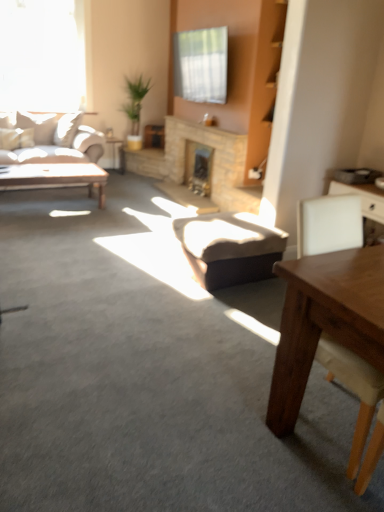
Question: Should I look upward or downward to see matte black side table at left?

Choices:
 (A) down
 (B) up

Answer: (B)

Question: Does transparent glass window at upper left have a lesser width compared to brick fireplace at center, marked as the second fireplace in a front-to-back arrangement?

Choices:
 (A) no
 (B) yes

Answer: (B)

Question: Is transparent glass window at upper left not near brick fireplace at center, marked as the second fireplace in a front-to-back arrangement?

Choices:
 (A) yes
 (B) no

Answer: (A)

Question: Is transparent glass window at upper left bigger than brick fireplace at center, which is the 1th fireplace from back to front?

Choices:
 (A) no
 (B) yes

Answer: (B)

Question: From the image's perspective, is transparent glass window at upper left located beneath brick fireplace at center, which is the 1th fireplace from back to front?

Choices:
 (A) no
 (B) yes

Answer: (A)

Question: Does transparent glass window at upper left appear on the left side of brick fireplace at center, marked as the second fireplace in a front-to-back arrangement?

Choices:
 (A) yes
 (B) no

Answer: (A)

Question: Does transparent glass window at upper left have a lesser height compared to brick fireplace at center, which is the 1th fireplace from back to front?

Choices:
 (A) no
 (B) yes

Answer: (A)

Question: Considering the relative sizes of wooden table at lower right and transparent glass window at upper left in the image provided, is wooden table at lower right shorter than transparent glass window at upper left?

Choices:
 (A) no
 (B) yes

Answer: (B)

Question: Considering the relative positions of wooden table at lower right and transparent glass window at upper left in the image provided, is wooden table at lower right behind transparent glass window at upper left?

Choices:
 (A) no
 (B) yes

Answer: (A)

Question: Is wooden table at lower right at the right side of transparent glass window at upper left?

Choices:
 (A) yes
 (B) no

Answer: (A)

Question: Is wooden table at lower right in front of transparent glass window at upper left?

Choices:
 (A) yes
 (B) no

Answer: (A)

Question: From the image's perspective, is wooden table at lower right located above transparent glass window at upper left?

Choices:
 (A) yes
 (B) no

Answer: (B)

Question: From a real-world perspective, is wooden table at lower right positioned over transparent glass window at upper left based on gravity?

Choices:
 (A) yes
 (B) no

Answer: (B)

Question: Is matte wooden coffee table at left bigger than matte black side table at left?

Choices:
 (A) no
 (B) yes

Answer: (B)